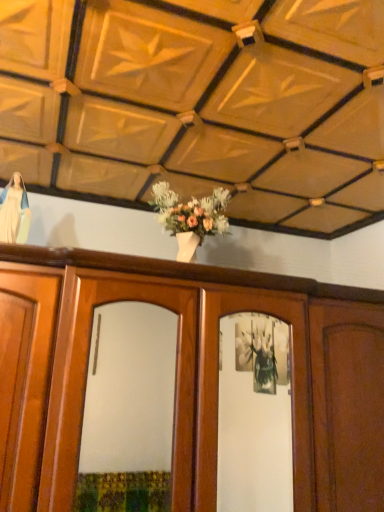
Question: Considering the positions of point (359, 307) and point (18, 189), is point (359, 307) closer or farther from the camera than point (18, 189)?

Choices:
 (A) closer
 (B) farther

Answer: (B)

Question: From a real-world perspective, is wooden cabinet at center physically located above or below white glossy statue at upper left?

Choices:
 (A) below
 (B) above

Answer: (A)

Question: Do you think wooden cabinet at center is within white glossy statue at upper left, or outside of it?

Choices:
 (A) inside
 (B) outside

Answer: (B)

Question: From a real-world perspective, is white glossy statue at upper left positioned above or below wooden cabinet at center?

Choices:
 (A) above
 (B) below

Answer: (A)

Question: Considering the positions of point (4, 199) and point (77, 344), is point (4, 199) closer or farther from the camera than point (77, 344)?

Choices:
 (A) farther
 (B) closer

Answer: (A)

Question: Is white glossy statue at upper left spatially inside wooden cabinet at center, or outside of it?

Choices:
 (A) outside
 (B) inside

Answer: (A)

Question: In terms of size, does white glossy statue at upper left appear bigger or smaller than wooden cabinet at center?

Choices:
 (A) big
 (B) small

Answer: (B)